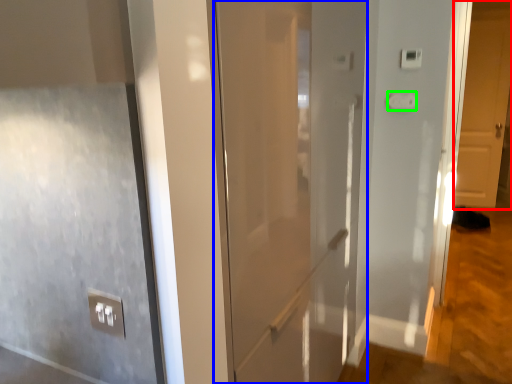
Question: Which object is the farthest from door (highlighted by a red box)? Choose among these: door (highlighted by a blue box) or light switch (highlighted by a green box).

Choices:
 (A) door
 (B) light switch

Answer: (A)